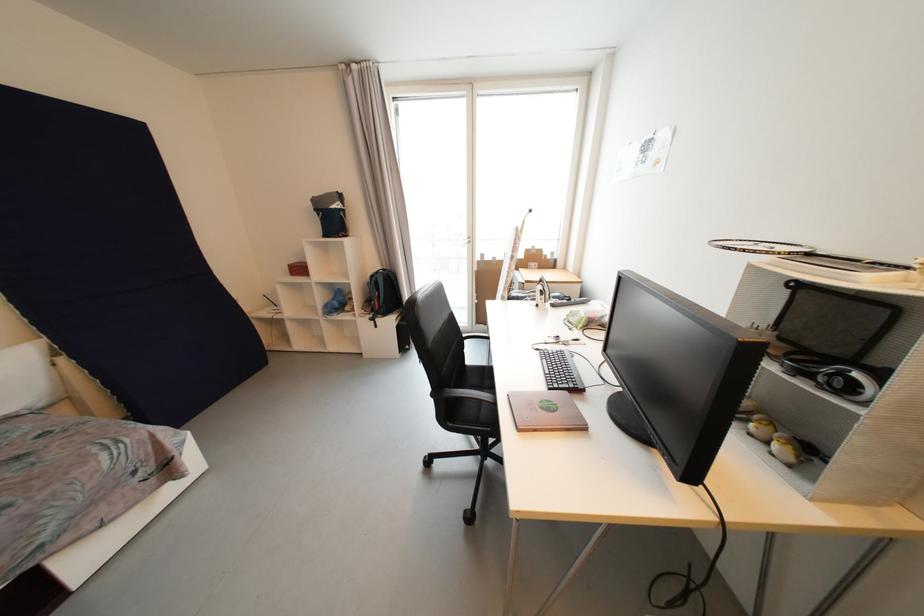
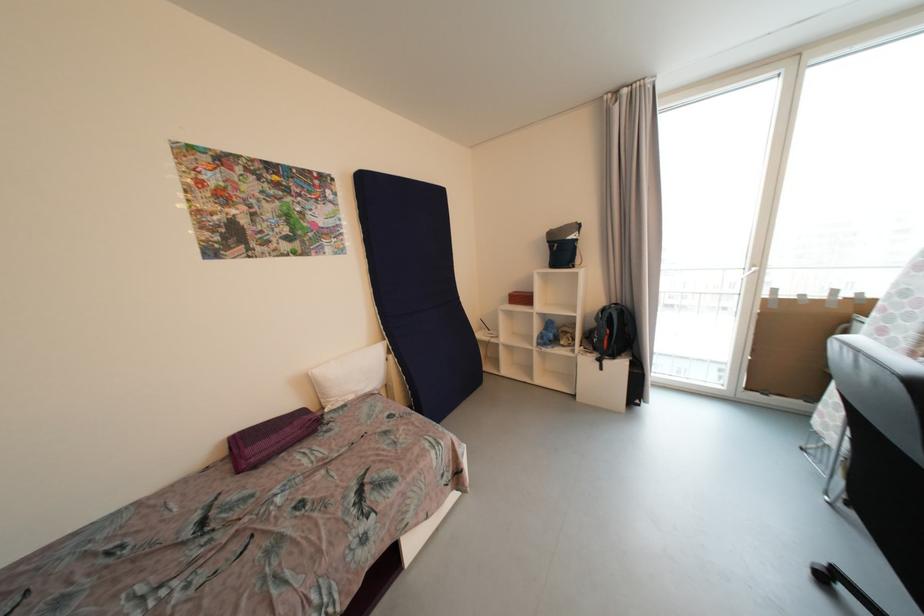
In the second image, find the point that corresponds to the point at 331,308 in the first image.

(545, 339)